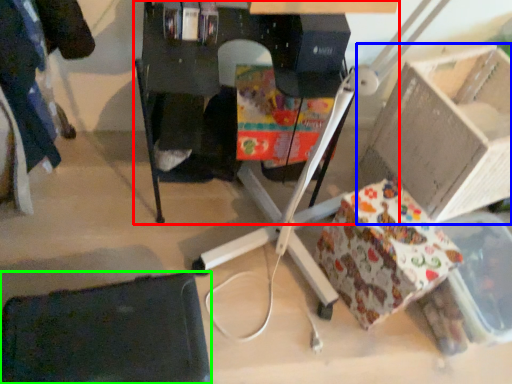
Question: Based on their relative distances, which object is nearer to furniture (highlighted by a red box)? Choose from cardboard box (highlighted by a blue box) and swivel chair (highlighted by a green box).

Choices:
 (A) cardboard box
 (B) swivel chair

Answer: (A)